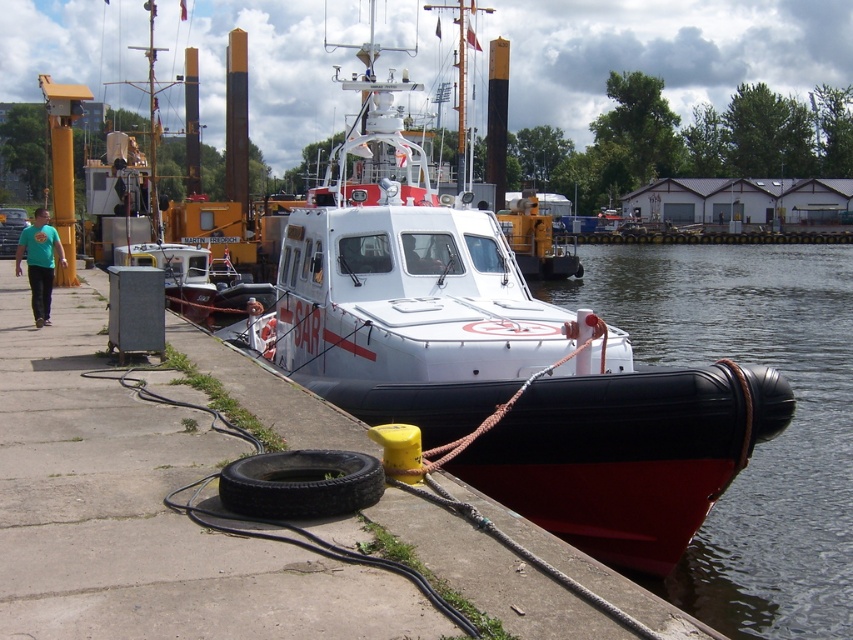
Question: Does black rubber boat at lower right have a larger size compared to black rubber tire at lower center?

Choices:
 (A) no
 (B) yes

Answer: (B)

Question: Where is black rubber boat at lower right located in relation to black rubber tire at lower center in the image?

Choices:
 (A) below
 (B) above

Answer: (B)

Question: Which object appears farthest from the camera in this image?

Choices:
 (A) black rubber boat at lower right
 (B) black rubber tire at lower center

Answer: (A)

Question: Does black rubber boat at lower right lie behind black rubber tire at lower center?

Choices:
 (A) no
 (B) yes

Answer: (B)

Question: Which object is farther from the camera taking this photo?

Choices:
 (A) black rubber boat at lower right
 (B) black rubber tire at lower center

Answer: (A)